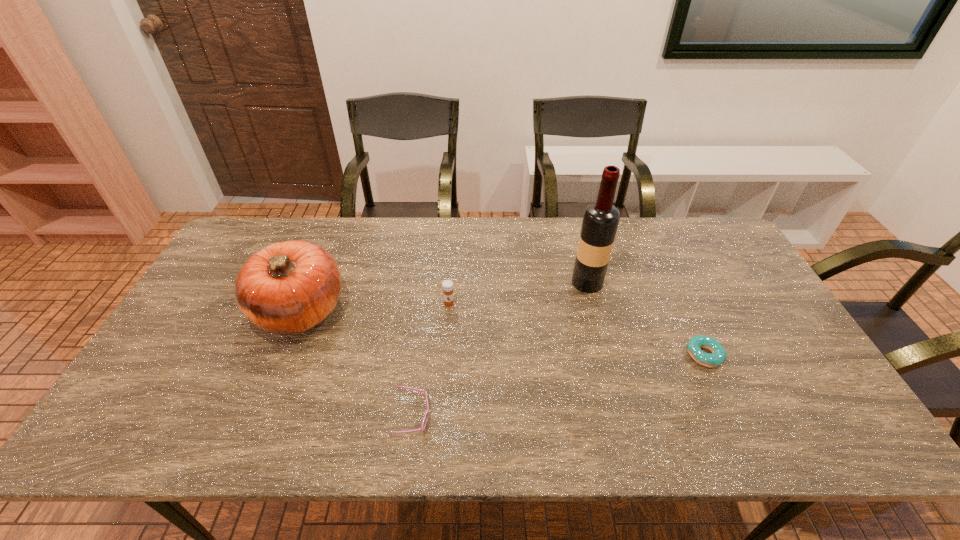
Where is `vacant space in between the third shortest object and the fourth object from right to left`? vacant space in between the third shortest object and the fourth object from right to left is located at coordinates (431, 360).

Where is `vacant area that lies between the sunglasses and the third object from right to left`? The height and width of the screenshot is (540, 960). vacant area that lies between the sunglasses and the third object from right to left is located at coordinates (431, 360).

Image resolution: width=960 pixels, height=540 pixels. I want to click on vacant area that lies between the fourth shortest object and the second object from right to left, so click(444, 296).

Locate an element on the screen. The height and width of the screenshot is (540, 960). object that is the nearest to the shortest object is located at coordinates (600, 221).

I want to click on object that stands as the third closest to the leftmost object, so tap(600, 221).

Locate an element on the screen. The image size is (960, 540). vacant space that satisfies the following two spatial constraints: 1. on the label side of the third object from left to right; 2. on the front-facing side of the sunglasses is located at coordinates 441,417.

Where is `vacant area in the image that satisfies the following two spatial constraints: 1. on the label side of the third object from left to right; 2. on the front-facing side of the sunglasses`? The height and width of the screenshot is (540, 960). vacant area in the image that satisfies the following two spatial constraints: 1. on the label side of the third object from left to right; 2. on the front-facing side of the sunglasses is located at coordinates (441, 417).

I want to click on free spot that satisfies the following two spatial constraints: 1. on the label side of the third object from left to right; 2. on the front-facing side of the sunglasses, so point(441,417).

The image size is (960, 540). I want to click on vacant point that satisfies the following two spatial constraints: 1. on the front side of the wine bottle; 2. on the front-facing side of the fourth object from right to left, so tap(622, 417).

I want to click on blank area in the image that satisfies the following two spatial constraints: 1. on the label side of the third object from left to right; 2. on the front-facing side of the fourth tallest object, so click(x=441, y=417).